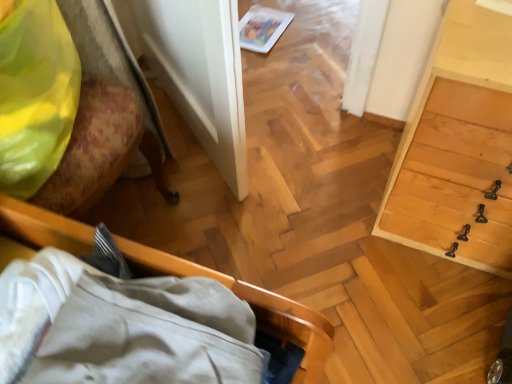
Describe the element at coordinates (251, 307) in the screenshot. I see `wooden bed frame at lower left, which ranks as the first furniture in right-to-left order` at that location.

Measure the distance between light wood dresser at right and camera.

light wood dresser at right and camera are 28.14 inches apart from each other.

The width and height of the screenshot is (512, 384). What do you see at coordinates (262, 28) in the screenshot?
I see `white glossy magazine at upper center` at bounding box center [262, 28].

The width and height of the screenshot is (512, 384). In order to click on matte yellow fabric at upper left in this screenshot , I will do `click(35, 95)`.

In order to click on wooden bed frame at lower left, the second furniture in the left-to-right sequence in this screenshot , I will do 251,307.

Considering the sizes of objects matte yellow fabric at upper left and light wood dresser at right in the image provided, who is bigger, matte yellow fabric at upper left or light wood dresser at right?

light wood dresser at right is bigger.

Considering the sizes of objects matte yellow fabric at upper left and light wood dresser at right in the image provided, who is thinner, matte yellow fabric at upper left or light wood dresser at right?

Thinner between the two is matte yellow fabric at upper left.

From the image's perspective, which is above, matte yellow fabric at upper left or light wood dresser at right?

matte yellow fabric at upper left, from the image's perspective.

Is matte yellow fabric at upper left inside the boundaries of light wood dresser at right, or outside?

matte yellow fabric at upper left is not enclosed by light wood dresser at right.

Which of these two, wooden bed frame at lower left, the second furniture in the left-to-right sequence, or white glossy magazine at upper center, is thinner?

white glossy magazine at upper center is thinner.

Is white glossy magazine at upper center inside wooden bed frame at lower left, which ranks as the first furniture in right-to-left order?

No, white glossy magazine at upper center is not inside wooden bed frame at lower left, which ranks as the first furniture in right-to-left order.

Find the location of `the 1st furniture to the left of the white glossy magazine at upper center, starting your count from the anchor`. the 1st furniture to the left of the white glossy magazine at upper center, starting your count from the anchor is located at coordinates coord(251,307).

From a real-world perspective, which is physically above, wooden bed frame at lower left, the second furniture in the left-to-right sequence, or white glossy magazine at upper center?

wooden bed frame at lower left, the second furniture in the left-to-right sequence, from a real-world perspective.

Which object is wider, white glossy magazine at upper center or wooden bed frame at lower left, which ranks as the first furniture in right-to-left order?

With larger width is wooden bed frame at lower left, which ranks as the first furniture in right-to-left order.

Is wooden bed frame at lower left, which ranks as the first furniture in right-to-left order, at the back of white glossy magazine at upper center?

That's not correct — white glossy magazine at upper center is not looking away from wooden bed frame at lower left, which ranks as the first furniture in right-to-left order.

This screenshot has width=512, height=384. I want to click on magazine behind the wooden bed frame at lower left, the second furniture in the left-to-right sequence, so click(262, 28).

Which is correct: white glossy magazine at upper center is inside wooden bed frame at lower left, which ranks as the first furniture in right-to-left order, or outside of it?

white glossy magazine at upper center is spatially situated outside wooden bed frame at lower left, which ranks as the first furniture in right-to-left order.

Is wooden chair at left, which is the first furniture in left-to-right order, closer to the viewer compared to light wood dresser at right?

Yes, wooden chair at left, which is the first furniture in left-to-right order, is closer to the viewer.

Between wooden chair at left, positioned as the second furniture in right-to-left order, and light wood dresser at right, which one has smaller width?

wooden chair at left, positioned as the second furniture in right-to-left order, is thinner.

Is wooden chair at left, positioned as the second furniture in right-to-left order, positioned beyond the bounds of light wood dresser at right?

Yes.

Is wooden chair at left, which is the first furniture in left-to-right order, aimed at light wood dresser at right?

No, wooden chair at left, which is the first furniture in left-to-right order, does not turn towards light wood dresser at right.

Is point (289, 18) positioned behind point (437, 168)?

Yes.

Is white glossy magazine at upper center placed right next to light wood dresser at right?

No, white glossy magazine at upper center is not next to light wood dresser at right.

Can you confirm if white glossy magazine at upper center is positioned to the right of light wood dresser at right?

No.

Consider the image. From the image's perspective, is white glossy magazine at upper center located above light wood dresser at right?

Correct, white glossy magazine at upper center appears higher than light wood dresser at right in the image.

From a real-world perspective, does wooden bed frame at lower left, the second furniture in the left-to-right sequence, sit lower than matte yellow fabric at upper left?

Yes.

Does wooden bed frame at lower left, the second furniture in the left-to-right sequence, have a greater height compared to matte yellow fabric at upper left?

No, wooden bed frame at lower left, the second furniture in the left-to-right sequence, is not taller than matte yellow fabric at upper left.

From the image's perspective, is wooden bed frame at lower left, which ranks as the first furniture in right-to-left order, on matte yellow fabric at upper left?

No, from the image's perspective, wooden bed frame at lower left, which ranks as the first furniture in right-to-left order, is not on top of matte yellow fabric at upper left.

Considering the relative sizes of wooden bed frame at lower left, the second furniture in the left-to-right sequence, and matte yellow fabric at upper left in the image provided, is wooden bed frame at lower left, the second furniture in the left-to-right sequence, thinner than matte yellow fabric at upper left?

Incorrect, the width of wooden bed frame at lower left, the second furniture in the left-to-right sequence, is not less than that of matte yellow fabric at upper left.

Is wooden chair at left, positioned as the second furniture in right-to-left order, situated inside wooden bed frame at lower left, the second furniture in the left-to-right sequence, or outside?

wooden chair at left, positioned as the second furniture in right-to-left order, exists outside the volume of wooden bed frame at lower left, the second furniture in the left-to-right sequence.

From the image's perspective, which is below, wooden chair at left, which is the first furniture in left-to-right order, or wooden bed frame at lower left, the second furniture in the left-to-right sequence?

wooden bed frame at lower left, the second furniture in the left-to-right sequence, appears lower in the image.

Locate an element on the screen. This screenshot has height=384, width=512. furniture above the wooden bed frame at lower left, the second furniture in the left-to-right sequence (from the image's perspective) is located at coordinates (68, 106).

Between wooden chair at left, which is the first furniture in left-to-right order, and wooden bed frame at lower left, which ranks as the first furniture in right-to-left order, which one has less height?

wooden bed frame at lower left, which ranks as the first furniture in right-to-left order, is shorter.

The image size is (512, 384). In order to click on clothing above the light wood dresser at right (from a real-world perspective) in this screenshot , I will do `click(35, 95)`.

From the white glossy magazine at upper center, count 2nd furnitures forward and point to it. Please provide its 2D coordinates.

[(251, 307)]

Based on their spatial positions, is matte yellow fabric at upper left or wooden chair at left, which is the first furniture in left-to-right order, further from light wood dresser at right?

matte yellow fabric at upper left is positioned further to the anchor light wood dresser at right.

Estimate the real-world distances between objects in this image. Which object is further from light wood dresser at right, wooden chair at left, which is the first furniture in left-to-right order, or white glossy magazine at upper center?

A: white glossy magazine at upper center is further to light wood dresser at right.

Considering their positions, is wooden chair at left, positioned as the second furniture in right-to-left order, positioned closer to white glossy magazine at upper center than wooden bed frame at lower left, the second furniture in the left-to-right sequence?

Based on the image, wooden chair at left, positioned as the second furniture in right-to-left order, appears to be nearer to white glossy magazine at upper center.

Considering their positions, is white glossy magazine at upper center positioned further to wooden bed frame at lower left, the second furniture in the left-to-right sequence, than wooden chair at left, which is the first furniture in left-to-right order?

white glossy magazine at upper center.

Based on the photo, when comparing their distances from wooden bed frame at lower left, the second furniture in the left-to-right sequence, does light wood dresser at right or matte yellow fabric at upper left seem closer?

matte yellow fabric at upper left lies closer to wooden bed frame at lower left, the second furniture in the left-to-right sequence, than the other object.

Considering their positions, is matte yellow fabric at upper left positioned further to wooden bed frame at lower left, the second furniture in the left-to-right sequence, than wooden chair at left, positioned as the second furniture in right-to-left order?

Based on the image, wooden chair at left, positioned as the second furniture in right-to-left order, appears to be further to wooden bed frame at lower left, the second furniture in the left-to-right sequence.

Considering their positions, is wooden chair at left, positioned as the second furniture in right-to-left order, positioned further to light wood dresser at right than wooden bed frame at lower left, which ranks as the first furniture in right-to-left order?

Based on the image, wooden chair at left, positioned as the second furniture in right-to-left order, appears to be further to light wood dresser at right.

Estimate the real-world distances between objects in this image. Which object is further from matte yellow fabric at upper left, white glossy magazine at upper center or light wood dresser at right?

white glossy magazine at upper center.

This screenshot has height=384, width=512. What are the coordinates of `clothing located between wooden chair at left, which is the first furniture in left-to-right order, and light wood dresser at right in the left-right direction` in the screenshot? It's located at (35, 95).

Find the location of `furniture between wooden bed frame at lower left, the second furniture in the left-to-right sequence, and white glossy magazine at upper center in the front-back direction`. furniture between wooden bed frame at lower left, the second furniture in the left-to-right sequence, and white glossy magazine at upper center in the front-back direction is located at coordinates (68, 106).

The image size is (512, 384). I want to click on furniture between matte yellow fabric at upper left and wooden bed frame at lower left, the second furniture in the left-to-right sequence, in the up-down direction, so click(68, 106).

This screenshot has width=512, height=384. Find the location of `clothing located between wooden bed frame at lower left, which ranks as the first furniture in right-to-left order, and white glossy magazine at upper center in the depth direction`. clothing located between wooden bed frame at lower left, which ranks as the first furniture in right-to-left order, and white glossy magazine at upper center in the depth direction is located at coordinates (35, 95).